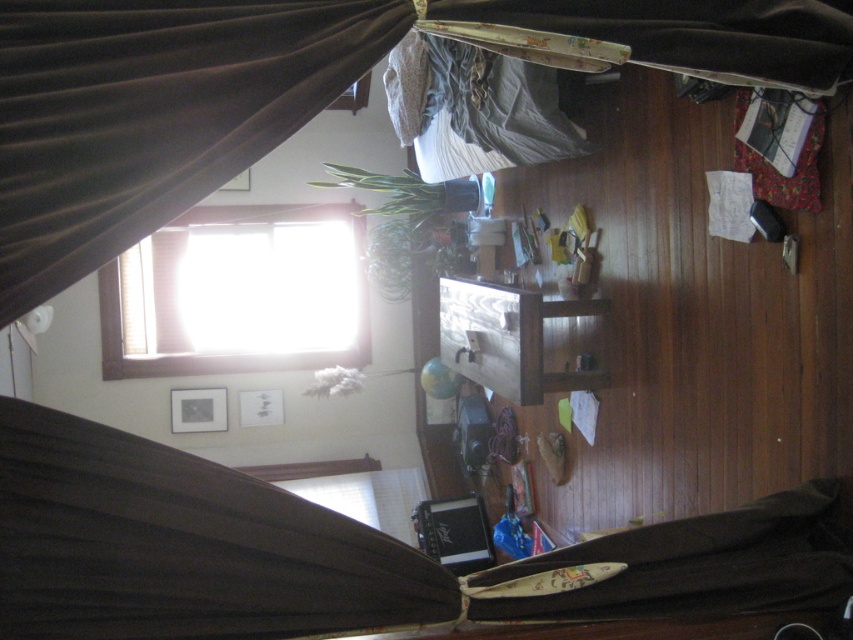
Can you confirm if velvet brown curtain at upper left is positioned above transparent glass window at upper center?

Yes.

Can you confirm if velvet brown curtain at upper left is shorter than transparent glass window at upper center?

Indeed, velvet brown curtain at upper left has a lesser height compared to transparent glass window at upper center.

Where is `velvet brown curtain at upper left`? velvet brown curtain at upper left is located at coordinates (152, 113).